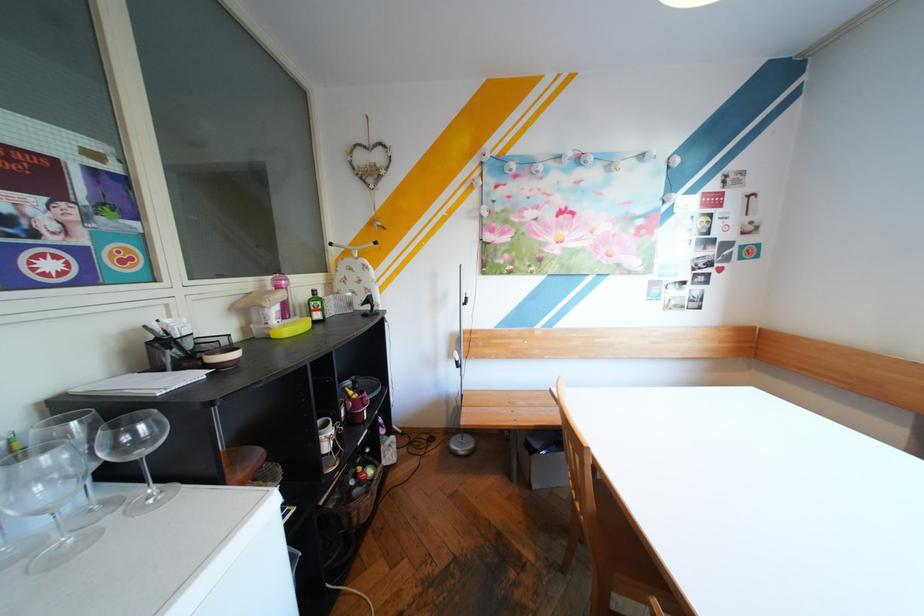
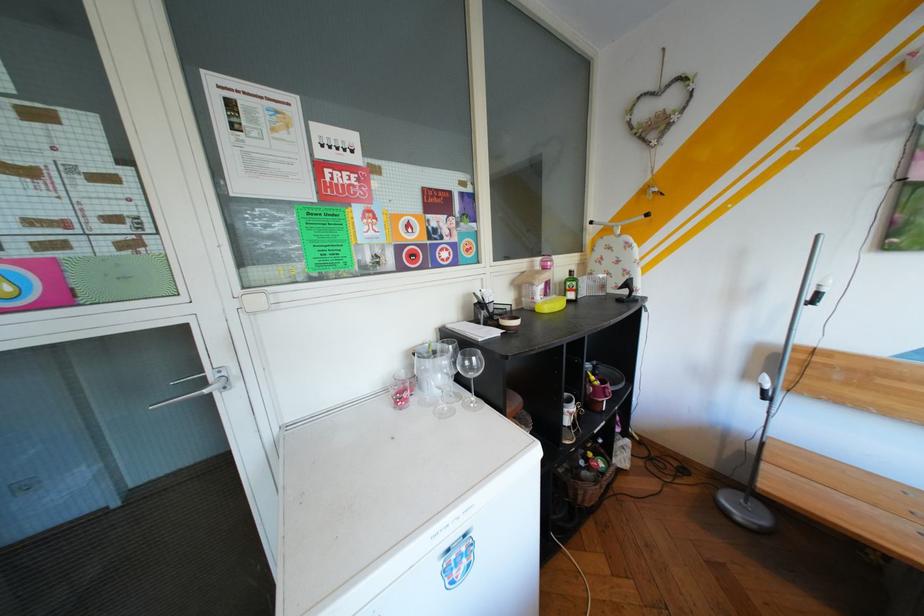
Where in the second image is the point corresponding to (372,468) from the first image?

(603, 454)